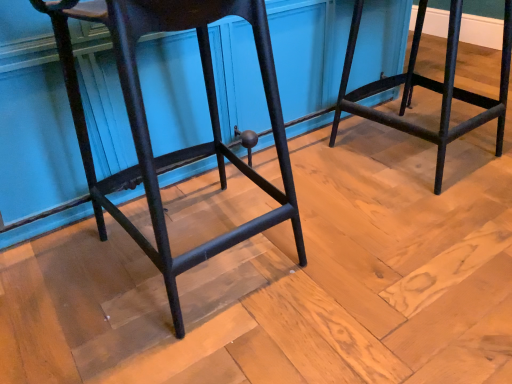
This screenshot has width=512, height=384. Describe the element at coordinates (428, 88) in the screenshot. I see `black metal stool at right, the second furniture viewed from the left` at that location.

Measure the distance between black metal stool at right, which ranks as the first furniture in right-to-left order, and camera.

A distance of 1.37 meters exists between black metal stool at right, which ranks as the first furniture in right-to-left order, and camera.

Identify the location of black metal stool at right, the second furniture viewed from the left. (428, 88).

This screenshot has height=384, width=512. Describe the element at coordinates (148, 129) in the screenshot. I see `matte black stool at center, the 2th furniture from the right` at that location.

Where is `matte black stool at center, which is counted as the first furniture, starting from the left`? The width and height of the screenshot is (512, 384). matte black stool at center, which is counted as the first furniture, starting from the left is located at coordinates (148, 129).

The image size is (512, 384). I want to click on black metal stool at right, which ranks as the first furniture in right-to-left order, so click(x=428, y=88).

Is black metal stool at right, which ranks as the first furniture in right-to-left order, to the left or to the right of matte black stool at center, the 2th furniture from the right, in the image?

From the image, it's evident that black metal stool at right, which ranks as the first furniture in right-to-left order, is to the right of matte black stool at center, the 2th furniture from the right.

Looking at this image, which object is further away from the camera, black metal stool at right, the second furniture viewed from the left, or matte black stool at center, which is counted as the first furniture, starting from the left?

black metal stool at right, the second furniture viewed from the left, is behind.

Is point (423, 131) farther from viewer compared to point (213, 97)?

No, (423, 131) is in front of (213, 97).

From the image's perspective, between black metal stool at right, the second furniture viewed from the left, and matte black stool at center, the 2th furniture from the right, who is located below?

matte black stool at center, the 2th furniture from the right, appears lower in the image.

In the scene shown: From a real-world perspective, is black metal stool at right, which ranks as the first furniture in right-to-left order, beneath matte black stool at center, which is counted as the first furniture, starting from the left?

Yes.

Which object is wider, black metal stool at right, which ranks as the first furniture in right-to-left order, or matte black stool at center, which is counted as the first furniture, starting from the left?

black metal stool at right, which ranks as the first furniture in right-to-left order, is wider.

Which of these two, black metal stool at right, the second furniture viewed from the left, or matte black stool at center, which is counted as the first furniture, starting from the left, stands taller?

matte black stool at center, which is counted as the first furniture, starting from the left.

Between black metal stool at right, which ranks as the first furniture in right-to-left order, and matte black stool at center, which is counted as the first furniture, starting from the left, which one has smaller size?

black metal stool at right, which ranks as the first furniture in right-to-left order, is smaller.

Is matte black stool at center, the 2th furniture from the right, a part of black metal stool at right, the second furniture viewed from the left?

Definitely not — matte black stool at center, the 2th furniture from the right, is not inside black metal stool at right, the second furniture viewed from the left.

Are black metal stool at right, the second furniture viewed from the left, and matte black stool at center, the 2th furniture from the right, located far from each other?

They are positioned close to each other.

Could you tell me if black metal stool at right, the second furniture viewed from the left, is turned towards matte black stool at center, which is counted as the first furniture, starting from the left?

No, black metal stool at right, the second furniture viewed from the left, does not turn towards matte black stool at center, which is counted as the first furniture, starting from the left.

In the image, there is a black metal stool at right, which ranks as the first furniture in right-to-left order. Where is `furniture below it (from the image's perspective)`? This screenshot has height=384, width=512. furniture below it (from the image's perspective) is located at coordinates (148, 129).

In the scene shown: Can you confirm if matte black stool at center, the 2th furniture from the right, is positioned to the left of black metal stool at right, the second furniture viewed from the left?

Yes, matte black stool at center, the 2th furniture from the right, is to the left of black metal stool at right, the second furniture viewed from the left.

Considering their positions, is matte black stool at center, the 2th furniture from the right, located in front of or behind black metal stool at right, the second furniture viewed from the left?

Visually, matte black stool at center, the 2th furniture from the right, is located in front of black metal stool at right, the second furniture viewed from the left.

Which point is more forward, [284,170] or [502,64]?

The point [284,170] is more forward.

From the image's perspective, which object appears higher, matte black stool at center, which is counted as the first furniture, starting from the left, or black metal stool at right, the second furniture viewed from the left?

black metal stool at right, the second furniture viewed from the left.

From a real-world perspective, is matte black stool at center, the 2th furniture from the right, below black metal stool at right, which ranks as the first furniture in right-to-left order?

No, from a real-world perspective, matte black stool at center, the 2th furniture from the right, is not beneath black metal stool at right, which ranks as the first furniture in right-to-left order.

Is matte black stool at center, which is counted as the first furniture, starting from the left, wider than black metal stool at right, the second furniture viewed from the left?

In fact, matte black stool at center, which is counted as the first furniture, starting from the left, might be narrower than black metal stool at right, the second furniture viewed from the left.

Does matte black stool at center, the 2th furniture from the right, have a greater height compared to black metal stool at right, the second furniture viewed from the left?

Correct, matte black stool at center, the 2th furniture from the right, is much taller as black metal stool at right, the second furniture viewed from the left.

Considering the relative sizes of matte black stool at center, which is counted as the first furniture, starting from the left, and black metal stool at right, which ranks as the first furniture in right-to-left order, in the image provided, is matte black stool at center, which is counted as the first furniture, starting from the left, smaller than black metal stool at right, which ranks as the first furniture in right-to-left order,?

No, matte black stool at center, which is counted as the first furniture, starting from the left, is not smaller than black metal stool at right, which ranks as the first furniture in right-to-left order.

Would you say matte black stool at center, which is counted as the first furniture, starting from the left, is outside black metal stool at right, which ranks as the first furniture in right-to-left order?

Absolutely, matte black stool at center, which is counted as the first furniture, starting from the left, is external to black metal stool at right, which ranks as the first furniture in right-to-left order.

Is matte black stool at center, which is counted as the first furniture, starting from the left, positioned far away from black metal stool at right, which ranks as the first furniture in right-to-left order?

No, there isn't a large distance between matte black stool at center, which is counted as the first furniture, starting from the left, and black metal stool at right, which ranks as the first furniture in right-to-left order.

Is black metal stool at right, which ranks as the first furniture in right-to-left order, at the back of matte black stool at center, the 2th furniture from the right?

No.

Can you tell me how much matte black stool at center, which is counted as the first furniture, starting from the left, and black metal stool at right, which ranks as the first furniture in right-to-left order, differ in facing direction?

matte black stool at center, which is counted as the first furniture, starting from the left, and black metal stool at right, which ranks as the first furniture in right-to-left order, are facing 0.0013 degrees away from each other.

How distant is matte black stool at center, the 2th furniture from the right, from black metal stool at right, the second furniture viewed from the left?

matte black stool at center, the 2th furniture from the right, is 31.12 inches from black metal stool at right, the second furniture viewed from the left.

You are a GUI agent. You are given a task and a screenshot of the screen. Output one action in this format:
    pyautogui.click(x=<x>, y=<y>)
    Task: Click on the furniture located below the black metal stool at right, the second furniture viewed from the left (from the image's perspective)
    This screenshot has height=384, width=512.
    Given the screenshot: What is the action you would take?
    pyautogui.click(x=148, y=129)

Where is `furniture on the left side of black metal stool at right, which ranks as the first furniture in right-to-left order`? The image size is (512, 384). furniture on the left side of black metal stool at right, which ranks as the first furniture in right-to-left order is located at coordinates (148, 129).

This screenshot has height=384, width=512. I want to click on furniture above the matte black stool at center, which is counted as the first furniture, starting from the left (from the image's perspective), so click(x=428, y=88).